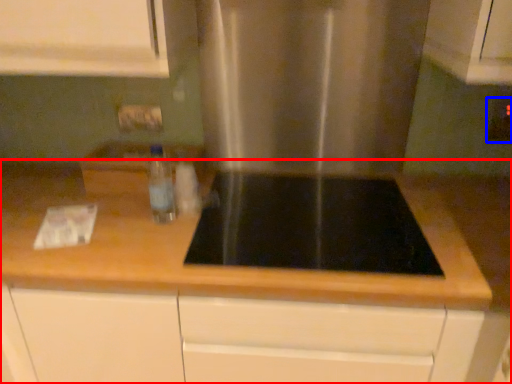
Question: Which object is closer to the camera taking this photo, countertop (highlighted by a red box) or electric outlet (highlighted by a blue box)?

Choices:
 (A) countertop
 (B) electric outlet

Answer: (A)